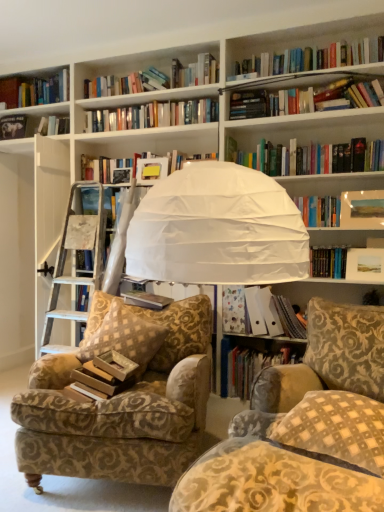
Question: Is checkered fabric pillow at lower right, which appears as the second pillow when viewed from the back, inside or outside of hardcover book at lower center, which appears as the fourth book when viewed from the top?

Choices:
 (A) inside
 (B) outside

Answer: (B)

Question: From their relative heights in the image, would you say checkered fabric pillow at lower right, the first pillow when ordered from front to back, is taller or shorter than hardcover book at lower center, which is the first book from bottom to top?

Choices:
 (A) tall
 (B) short

Answer: (B)

Question: Estimate the real-world distances between objects in this image. Which object is closer to the hardcover book at upper left, the fourth book when ordered from right to left?

Choices:
 (A) gold-patterned fabric pillow at center-left, which ranks as the 1th pillow in left-to-right order
 (B) patterned fabric armchair at left
 (C) hardcover book at center, the third book positioned from the bottom
 (D) hardcover book at lower center, which appears as the fourth book when viewed from the top
 (E) brown paperback book at center-left

Answer: (C)

Question: Estimate the real-world distances between objects in this image. Which object is closer to the patterned fabric armchair at left?

Choices:
 (A) matte paper folder at center right, marked as the first book in a right-to-left arrangement
 (B) hardcover book at lower center, which appears as the fourth book when viewed from the top
 (C) hardcover book at center, the 2th book positioned from the left
 (D) hardcover book at upper left, which ranks as the 1th book in top-to-bottom order
 (E) checkered fabric pillow at lower right, which ranks as the first pillow in right-to-left order

Answer: (C)